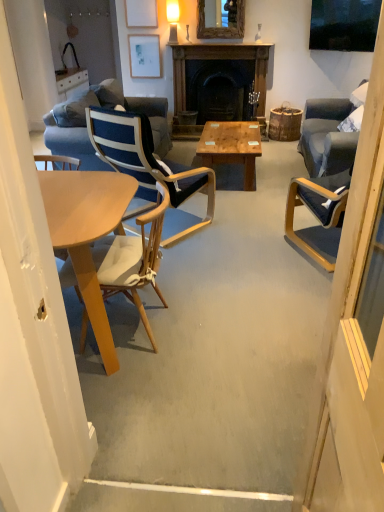
Question: From the image's perspective, relative to matte blue chair at right, is matte white lampshade at upper center above or below?

Choices:
 (A) above
 (B) below

Answer: (A)

Question: Is matte white lampshade at upper center bigger or smaller than matte blue chair at right?

Choices:
 (A) small
 (B) big

Answer: (A)

Question: Which of these objects is positioned farthest from the wooden frame mirror at upper center?

Choices:
 (A) matte blue chair at right
 (B) matte white picture frame at upper center, the second picture frame positioned from the front
 (C) natural wood chair at left, the second chair viewed from the back
 (D) blue fabric couch at center
 (E) wooden fireplace at center

Answer: (A)

Question: Which object is the closest to the wooden frame mirror at upper center?

Choices:
 (A) natural wood chair at left, the second chair viewed from the back
 (B) matte white picture frame at upper center, the second picture frame positioned from the top
 (C) blue fabric chair at center, placed as the 2th chair when sorted from front to back
 (D) blue fabric couch at center
 (E) matte white lampshade at upper center

Answer: (E)